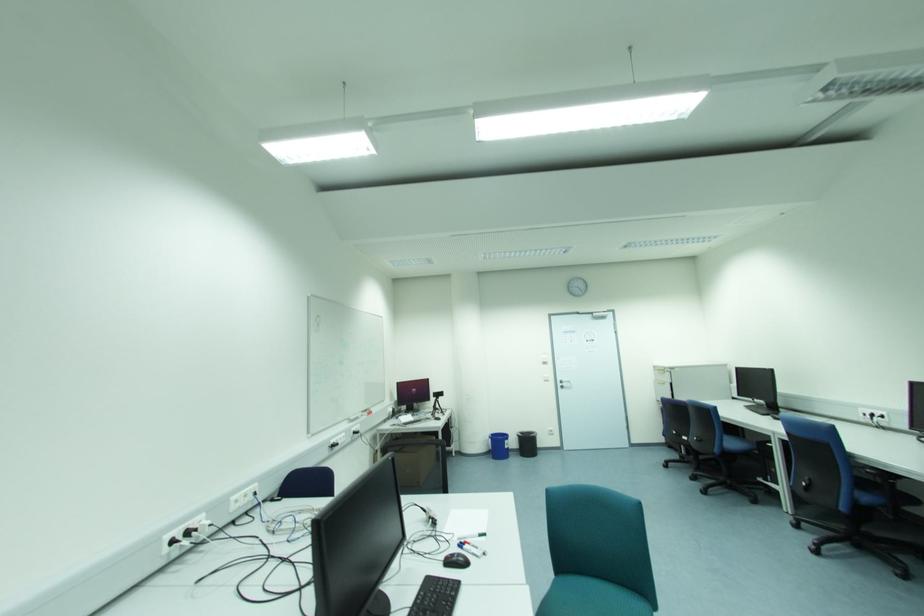
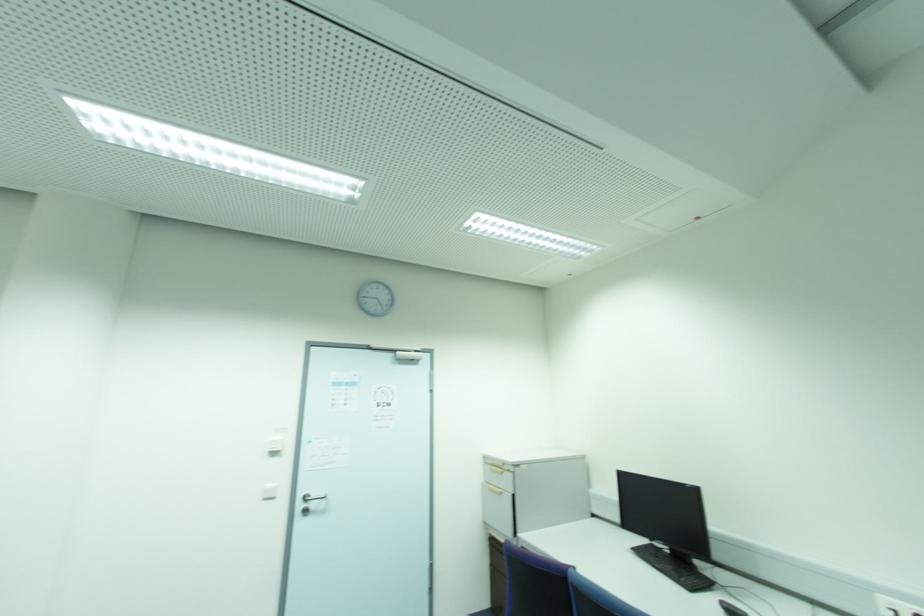
Where in the second image is the point corresponding to (548,376) from the first image?

(274, 485)